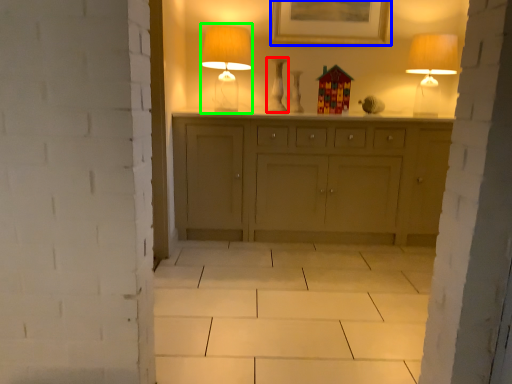
Question: Considering the real-world distances, which object is closest to vase (highlighted by a red box)? picture frame (highlighted by a blue box) or table lamp (highlighted by a green box).

Choices:
 (A) picture frame
 (B) table lamp

Answer: (B)